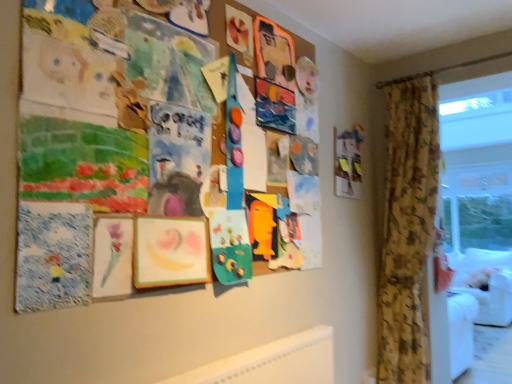
Question: Is transparent plastic window screen at right outside floral fabric curtain at right?

Choices:
 (A) no
 (B) yes

Answer: (B)

Question: Is the position of transparent plastic window screen at right more distant than that of floral fabric curtain at right?

Choices:
 (A) yes
 (B) no

Answer: (A)

Question: Is transparent plastic window screen at right looking in the opposite direction of floral fabric curtain at right?

Choices:
 (A) no
 (B) yes

Answer: (A)

Question: From the image's perspective, is transparent plastic window screen at right above floral fabric curtain at right?

Choices:
 (A) no
 (B) yes

Answer: (B)

Question: Considering the relative sizes of transparent plastic window screen at right and floral fabric curtain at right in the image provided, is transparent plastic window screen at right bigger than floral fabric curtain at right?

Choices:
 (A) no
 (B) yes

Answer: (A)

Question: From a real-world perspective, is white fabric couch at right physically located above or below floral fabric curtain at right?

Choices:
 (A) below
 (B) above

Answer: (A)

Question: Is white fabric couch at right in front of or behind floral fabric curtain at right in the image?

Choices:
 (A) front
 (B) behind

Answer: (B)

Question: Which is correct: white fabric couch at right is inside floral fabric curtain at right, or outside of it?

Choices:
 (A) inside
 (B) outside

Answer: (B)

Question: Is white fabric couch at right taller or shorter than floral fabric curtain at right?

Choices:
 (A) short
 (B) tall

Answer: (A)

Question: Considering the positions of floral fabric curtain at right and transparent plastic window screen at right in the image, is floral fabric curtain at right bigger or smaller than transparent plastic window screen at right?

Choices:
 (A) big
 (B) small

Answer: (A)

Question: In the image, is floral fabric curtain at right on the left side or the right side of transparent plastic window screen at right?

Choices:
 (A) left
 (B) right

Answer: (A)

Question: From a real-world perspective, is floral fabric curtain at right physically located above or below transparent plastic window screen at right?

Choices:
 (A) above
 (B) below

Answer: (B)

Question: Is floral fabric curtain at right in front of or behind transparent plastic window screen at right in the image?

Choices:
 (A) front
 (B) behind

Answer: (A)

Question: Considering the positions of point (349, 165) and point (450, 223), is point (349, 165) closer or farther from the camera than point (450, 223)?

Choices:
 (A) farther
 (B) closer

Answer: (B)

Question: Is wooden picture frame at upper right spatially inside transparent plastic window screen at right, or outside of it?

Choices:
 (A) outside
 (B) inside

Answer: (A)